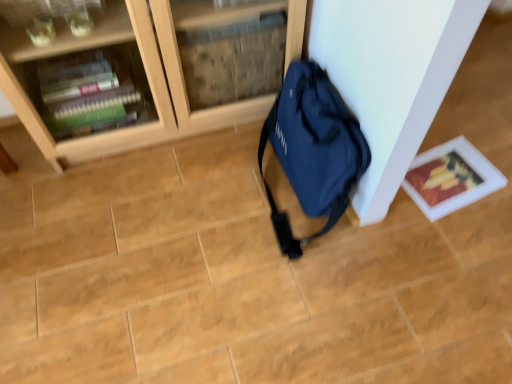
Image resolution: width=512 pixels, height=384 pixels. What do you see at coordinates (313, 149) in the screenshot? I see `matte blue bag at center-right` at bounding box center [313, 149].

Identify the location of matte blue bag at center-right. Image resolution: width=512 pixels, height=384 pixels. (313, 149).

What are the coordinates of `matte blue bag at center-right` in the screenshot? It's located at (313, 149).